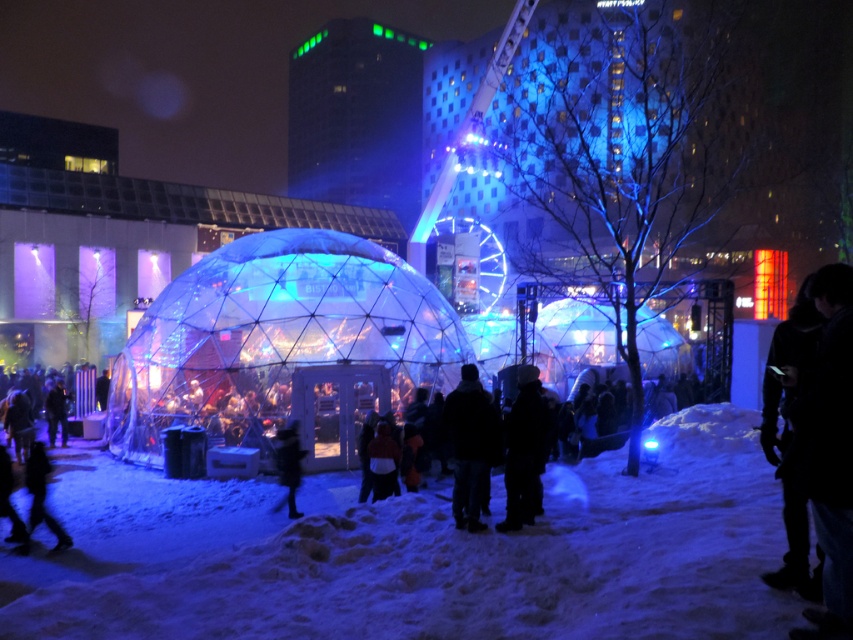
You are standing at the entrance of the geodesic dome structure and see the dark wool coat at center. If you want to reach the coat quickly, in which direction should you move from your current position?

The dark wool coat at center is located at point (x=469, y=445), so you should move towards the center of the dome to reach it quickly.

You are standing in front of the geodesic dome and see the dark wool coat at center. If you want to reach the coat without moving your position, is it possible?

The dark wool coat at center is 13.35 meters away from camera, so you cannot reach it without moving your position since it is too far.